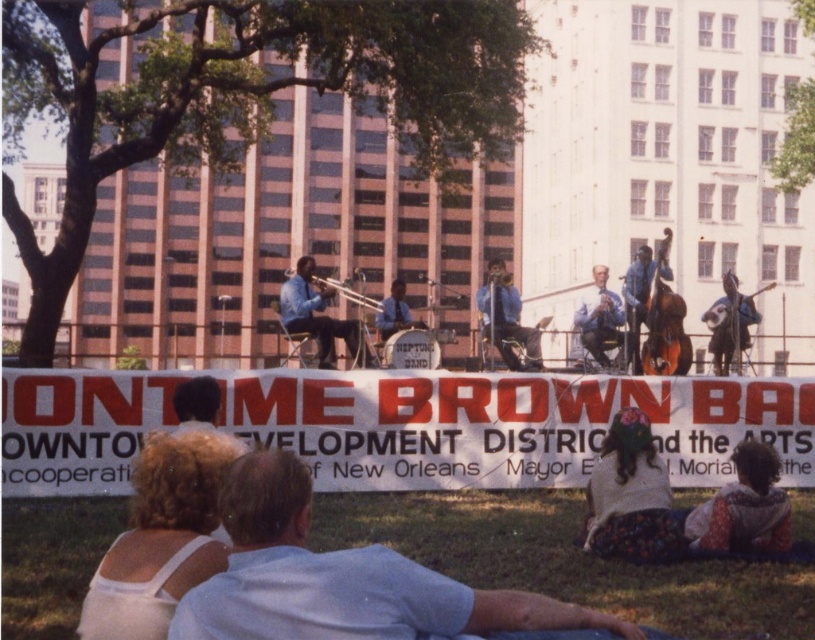
You are a photographer setting up for the ONTIME BROWN BAND performance. You need to position your camera so that both the shiny silver guitar at right and the shiny silver trumpet at center are fully visible in the frame. Given their sizes, which object should you ensure has more space allocated in your camera frame?

The shiny silver trumpet at center requires more space in the camera frame because it occupies more space than the shiny silver guitar at right.

You are a photographer who wants to take a picture of the shiny silver guitar at right and the shiny silver trumpet at center. You need to know which one is closer to the front of the stage so you can focus your camera properly. Can you tell me which one is closer to the front?

The shiny silver guitar at right is positioned under the shiny silver trumpet at center, meaning it is closer to the front of the stage. Focus your camera on the shiny silver guitar at right first as it is nearer.